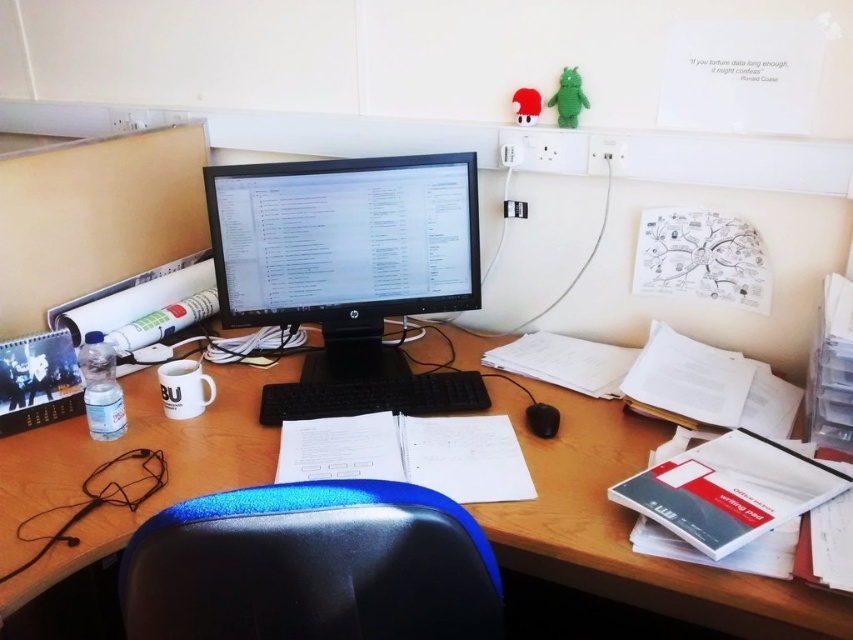
In the scene shown: Is black glossy monitor at center below blue textured swivel chair at center?

No.

Between black glossy monitor at center and blue textured swivel chair at center, which one has more height?

With more height is black glossy monitor at center.

You are a GUI agent. You are given a task and a screenshot of the screen. Output one action in this format:
    pyautogui.click(x=<x>, y=<y>)
    Task: Click on the black glossy monitor at center
    
    Given the screenshot: What is the action you would take?
    pyautogui.click(x=349, y=273)

Which is in front, point (239, 234) or point (538, 404)?

Point (538, 404) is in front.

At what (x,y) coordinates should I click in order to perform the action: click on black glossy monitor at center. Please return your answer as a coordinate pair (x, y). This screenshot has height=640, width=853. Looking at the image, I should click on (349, 273).

Which is behind, point (451, 241) or point (556, 419)?

The point (451, 241) is behind.

This screenshot has height=640, width=853. Identify the location of black glossy monitor at center. (349, 273).

Between wooden at center and black plastic keyboard at center, which one appears on the right side from the viewer's perspective?

Positioned to the right is black plastic keyboard at center.

Is point (607, 461) positioned in front of point (326, 381)?

Yes, it is in front of point (326, 381).

Is point (41, 524) in front of point (451, 376)?

That is True.

Identify the location of wooden at center. (628, 529).